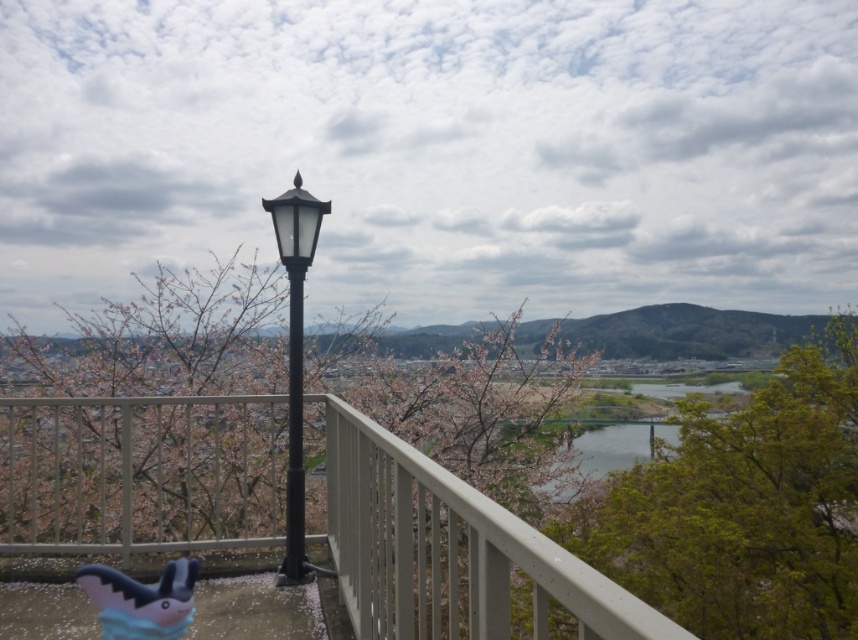
Is white matte balcony at center bigger than black metal pole at center?

Yes, white matte balcony at center is bigger than black metal pole at center.

Which is behind, point (500, 618) or point (289, 538)?

Point (289, 538)

Which is in front, point (260, 435) or point (289, 520)?

Point (289, 520) is in front.

Locate an element on the screen. The width and height of the screenshot is (858, 640). white matte balcony at center is located at coordinates (451, 552).

Is black matte lamp post at center smaller than black metal pole at center?

Incorrect, black matte lamp post at center is not smaller in size than black metal pole at center.

Which is behind, point (294, 209) or point (292, 444)?

Point (292, 444)

Find the location of `black matte lamp post at center`. black matte lamp post at center is located at coordinates (295, 358).

Who is more distant from viewer, (112, 512) or (299, 244)?

The point (112, 512) is more distant.

This screenshot has width=858, height=640. What do you see at coordinates (451, 552) in the screenshot?
I see `white matte balcony at center` at bounding box center [451, 552].

Locate an element on the screen. This screenshot has height=640, width=858. white matte balcony at center is located at coordinates (451, 552).